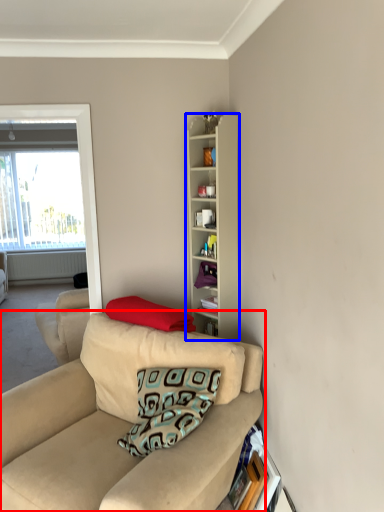
Question: Which object is closer to the camera taking this photo, studio couch (highlighted by a red box) or cabinetry (highlighted by a blue box)?

Choices:
 (A) studio couch
 (B) cabinetry

Answer: (A)